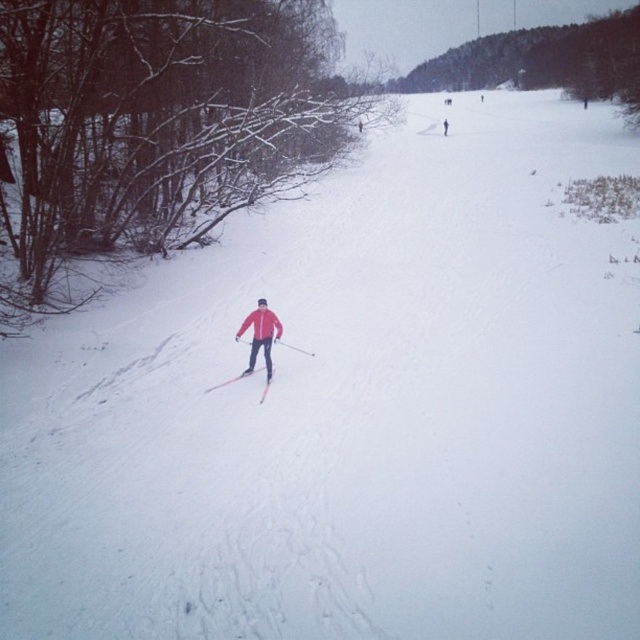
You are a photographer trying to capture a photo of the green leafy tree at upper center and the matte red jacket at center. From the perspective of the photographer, which object is located to the right of the other?

The green leafy tree at upper center is positioned to the right of the matte red jacket at center.

You are a photographer trying to capture the red jacket skier at center while ensuring the snowy bare branches at left are visible in the frame. Based on their positions, will the branches be in the background or foreground of the photo?

The snowy bare branches at left are positioned under the red jacket skier at center, meaning they are closer to the camera. Therefore, the branches will be in the foreground of the photo.